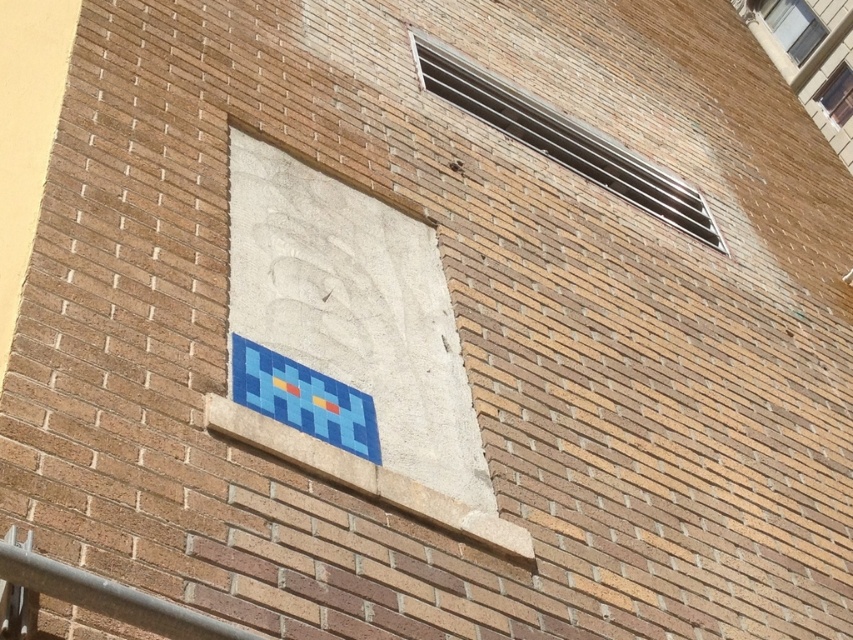
You are an inspector checking the building facade. You notice the metallic silver vent at upper right and the clear glass window at upper right. Which one is positioned lower on the wall?

The metallic silver vent at upper right is below the clear glass window at upper right, so the vent is positioned lower on the wall.

You are an architect designing a new ventilation system for a building. You need to place a new vent in the wall shown in the image. The existing metallic silver vent at upper right is located at point 0.220, 0.660. To ensure proper airflow, the new vent must be placed at least 1.5 meters away from the existing one. Can you determine if the proposed location at point 0.350, 0.780 is suitable?

The distance between the existing metallic silver vent at upper right at point (x=561, y=140) and the proposed location at point (x=664, y=224) is approximately 0.13 meters in the x and y directions. Since the required distance is at least 1.5 meters, the proposed location is not suitable.

You are an architect examining the brick wall and notice two windows at the upper right corner. Which window is taller between the clear glass window at upper right and the transparent glass window at upper right?

The clear glass window at upper right is taller than the transparent glass window at upper right according to the description.